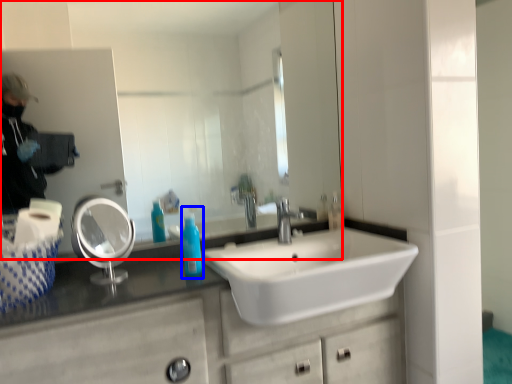
Question: Which object appears closest to the camera in this image, mirror (highlighted by a red box) or cleaning product (highlighted by a blue box)?

Choices:
 (A) mirror
 (B) cleaning product

Answer: (B)